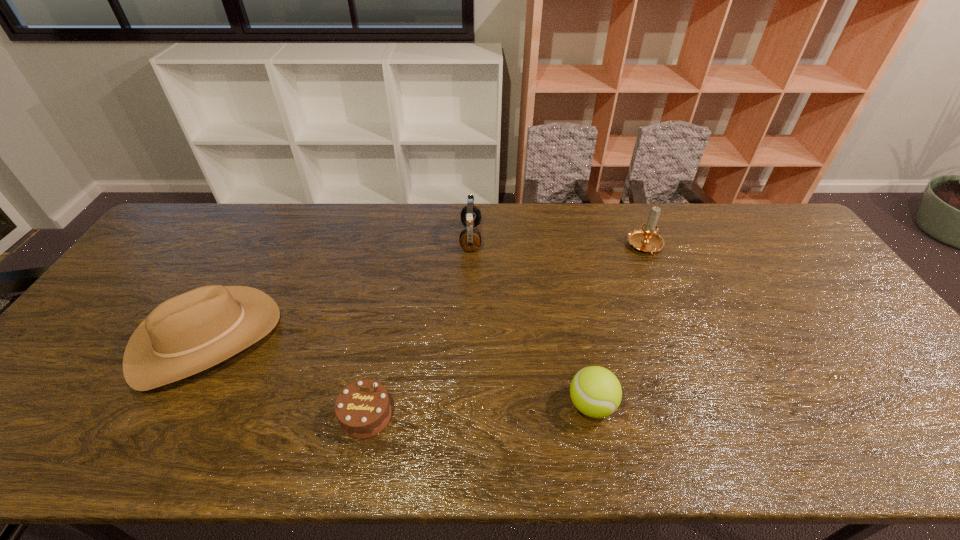
Locate an element on the screen. This screenshot has width=960, height=540. the rightmost object is located at coordinates (646, 239).

Where is `the third object from right to left`? The height and width of the screenshot is (540, 960). the third object from right to left is located at coordinates (470, 239).

What are the coordinates of `the leftmost object` in the screenshot? It's located at (191, 332).

This screenshot has width=960, height=540. What are the coordinates of `tennis ball` in the screenshot? It's located at (595, 391).

Locate an element on the screen. This screenshot has width=960, height=540. the fourth tallest object is located at coordinates (595, 391).

Identify the location of the shortest object. (363, 410).

This screenshot has width=960, height=540. I want to click on chocolate cake, so click(363, 410).

Find the location of a particular element. vacant area located on the right of the rightmost object is located at coordinates (709, 247).

Find the location of a particular element. The width and height of the screenshot is (960, 540). vacant region located 0.050m on the ear cups of the headset is located at coordinates (496, 238).

The image size is (960, 540). Identify the location of free space located on the right of the cowboy hat. (384, 338).